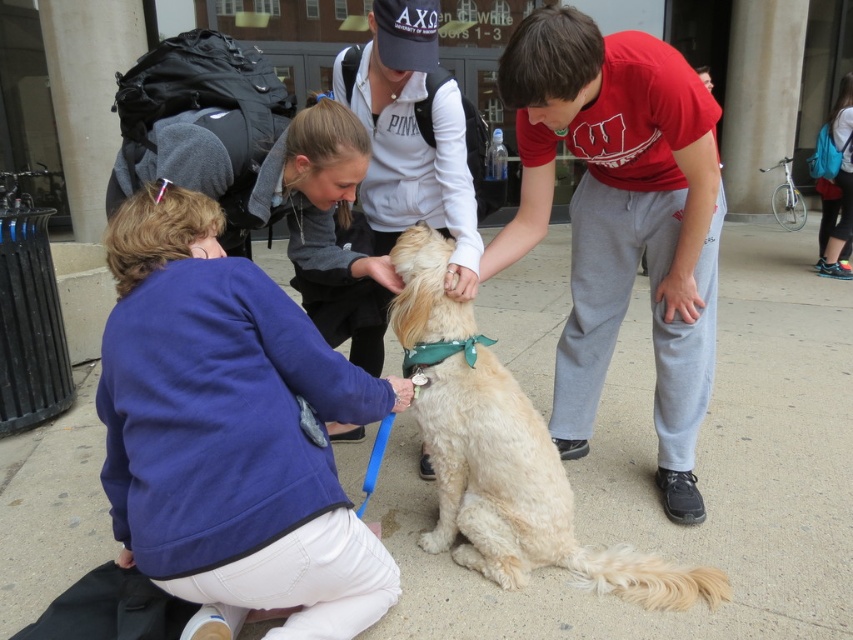
Question: Is smooth concrete pavement at center further to the viewer compared to golden fur dog at center?

Choices:
 (A) no
 (B) yes

Answer: (B)

Question: Can you confirm if smooth concrete pavement at center is positioned to the left of golden fur dog at center?

Choices:
 (A) no
 (B) yes

Answer: (A)

Question: Is smooth concrete pavement at center smaller than golden fur dog at center?

Choices:
 (A) yes
 (B) no

Answer: (A)